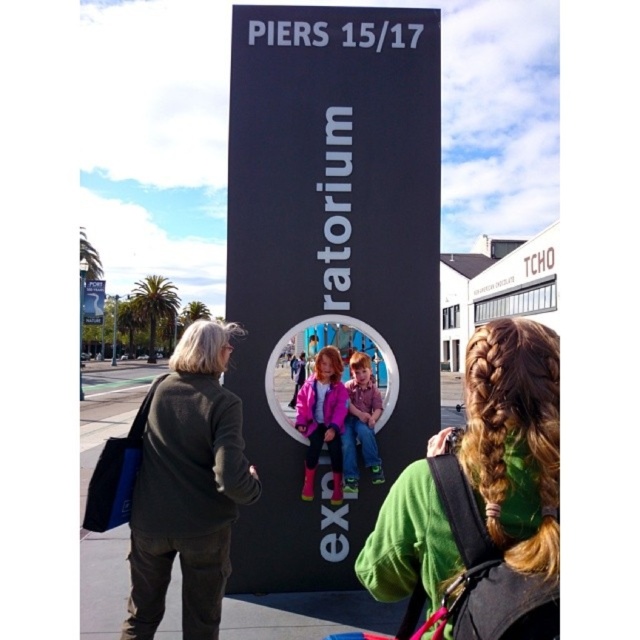
Is black matte sign at center thinner than dark gray sweater at left?

No, black matte sign at center is not thinner than dark gray sweater at left.

Who is taller, black matte sign at center or dark gray sweater at left?

black matte sign at center

You are a GUI agent. You are given a task and a screenshot of the screen. Output one action in this format:
    pyautogui.click(x=<x>, y=<y>)
    Task: Click on the black matte sign at center
    The image size is (640, 640).
    Given the screenshot: What is the action you would take?
    pyautogui.click(x=330, y=252)

The width and height of the screenshot is (640, 640). Identify the location of black matte sign at center. (330, 252).

Can you confirm if dark gray sweater at left is positioned above matte pink jacket at center?

Indeed, dark gray sweater at left is positioned over matte pink jacket at center.

What do you see at coordinates (188, 486) in the screenshot? This screenshot has height=640, width=640. I see `dark gray sweater at left` at bounding box center [188, 486].

Locate an element on the screen. dark gray sweater at left is located at coordinates 188,486.

Which is more to the right, green fleece jacket at center or matte pink jacket at center?

green fleece jacket at center

Consider the image. Can you confirm if green fleece jacket at center is taller than matte pink jacket at center?

Yes, green fleece jacket at center is taller than matte pink jacket at center.

Between point (452, 600) and point (369, 432), which one is positioned behind?

The point (369, 432) is more distant.

In order to click on green fleece jacket at center in this screenshot , I will do `click(513, 442)`.